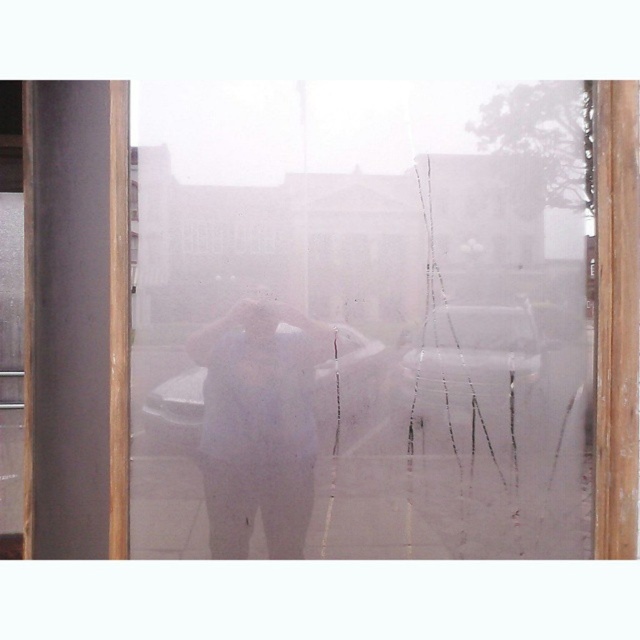
You are a delivery person holding a package that is 2 meters long. You need to deliver it through the frosted glass door at center. Can you fit the package through the door without bending it?

The frosted glass door at center is only 1.99 meters away from the viewer, which is shorter than the 2 meters long package. Therefore, the package cannot fit through the door without bending it.

You are a delivery person trying to determine if the white matte shirt at center can be folded and placed inside the white matte car at center. Based on their sizes, is this possible?

The white matte shirt at center is larger in size than white matte car at center, so it cannot be folded and placed inside the white matte car at center.

You are a delivery person trying to see through the frosted glass door at center to locate the metallic silver car at center. Based on the scene description, can you see the car through the door?

The frosted glass door at center is above the metallic silver car at center, so the car is below the door. Since the door is frosted and obstructs visibility, you cannot see the car through the door.